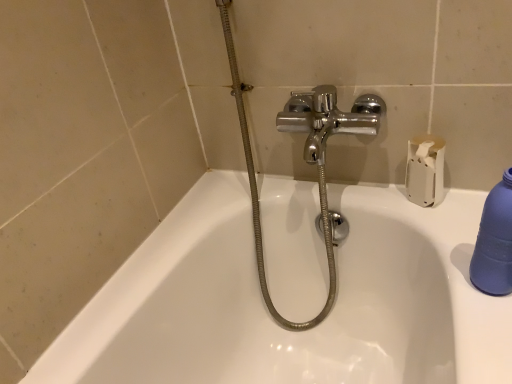
Question: Is white matte toilet paper at upper right positioned behind blue matte bottle at right?

Choices:
 (A) no
 (B) yes

Answer: (B)

Question: Is white matte toilet paper at upper right facing towards blue matte bottle at right?

Choices:
 (A) yes
 (B) no

Answer: (B)

Question: Does white matte toilet paper at upper right come in front of blue matte bottle at right?

Choices:
 (A) yes
 (B) no

Answer: (B)

Question: Is white matte toilet paper at upper right taller than blue matte bottle at right?

Choices:
 (A) yes
 (B) no

Answer: (B)

Question: Can you confirm if white matte toilet paper at upper right is bigger than blue matte bottle at right?

Choices:
 (A) yes
 (B) no

Answer: (A)

Question: From the image's perspective, is blue matte bottle at right positioned above or below chrome metallic shower at center?

Choices:
 (A) below
 (B) above

Answer: (A)

Question: Considering the positions of blue matte bottle at right and chrome metallic shower at center in the image, is blue matte bottle at right wider or thinner than chrome metallic shower at center?

Choices:
 (A) wide
 (B) thin

Answer: (B)

Question: Considering the positions of blue matte bottle at right and chrome metallic shower at center in the image, is blue matte bottle at right taller or shorter than chrome metallic shower at center?

Choices:
 (A) short
 (B) tall

Answer: (A)

Question: Is point (486, 208) closer or farther from the camera than point (245, 129)?

Choices:
 (A) farther
 (B) closer

Answer: (B)

Question: From a real-world perspective, is chrome metallic shower at center positioned above or below white matte toilet paper at upper right?

Choices:
 (A) above
 (B) below

Answer: (B)

Question: From the image's perspective, is chrome metallic shower at center located above or below white matte toilet paper at upper right?

Choices:
 (A) above
 (B) below

Answer: (B)

Question: In the image, is chrome metallic shower at center on the left side or the right side of white matte toilet paper at upper right?

Choices:
 (A) right
 (B) left

Answer: (B)

Question: Does point (325, 226) appear closer or farther from the camera than point (412, 170)?

Choices:
 (A) farther
 (B) closer

Answer: (A)

Question: Is white matte toilet paper at upper right bigger or smaller than chrome metallic shower at center?

Choices:
 (A) big
 (B) small

Answer: (B)

Question: From their relative heights in the image, would you say white matte toilet paper at upper right is taller or shorter than chrome metallic shower at center?

Choices:
 (A) short
 (B) tall

Answer: (A)